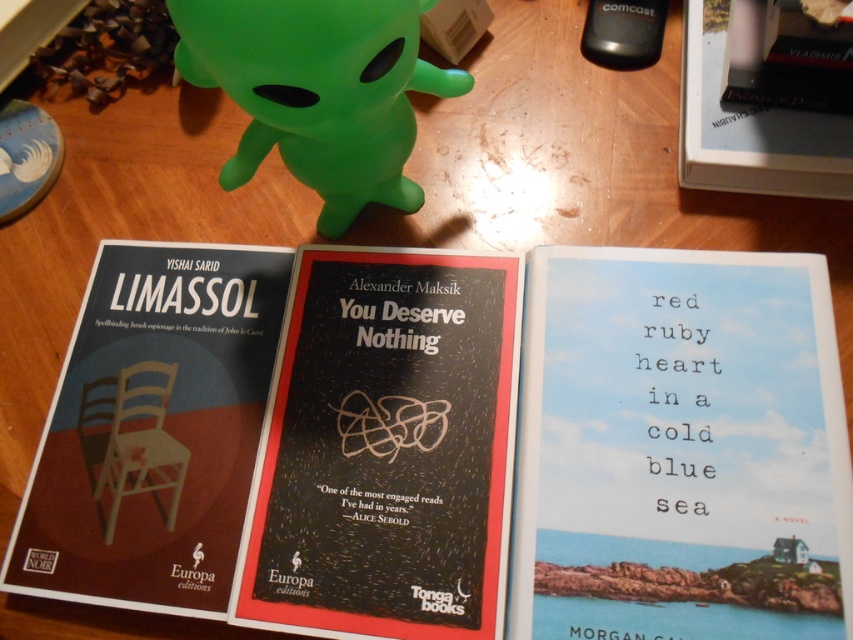
Which is more to the right, blue paper cover at center or hardcover book at upper right?

Positioned to the right is hardcover book at upper right.

From the picture: Who is shorter, blue paper cover at center or hardcover book at upper right?

hardcover book at upper right

You are a GUI agent. You are given a task and a screenshot of the screen. Output one action in this format:
    pyautogui.click(x=<x>, y=<y>)
    Task: Click on the blue paper cover at center
    The width and height of the screenshot is (853, 640).
    Given the screenshot: What is the action you would take?
    (x=680, y=449)

Is black matte book cover at center closer to camera compared to hardcover book at upper right?

Yes, black matte book cover at center is closer to the viewer.

Which is behind, point (431, 484) or point (694, 33)?

Point (694, 33)

At what (x,y) coordinates should I click in order to perform the action: click on black matte book cover at center. Please return your answer as a coordinate pair (x, y). The image size is (853, 640). Looking at the image, I should click on (386, 449).

Does point (225, 420) come farther from viewer compared to point (848, 170)?

No, (225, 420) is in front of (848, 170).

Can you confirm if matte black chair at center left is positioned to the left of hardcover book at upper right?

Correct, you'll find matte black chair at center left to the left of hardcover book at upper right.

Where is `matte black chair at center left`? This screenshot has height=640, width=853. matte black chair at center left is located at coordinates (152, 429).

I want to click on matte black chair at center left, so click(x=152, y=429).